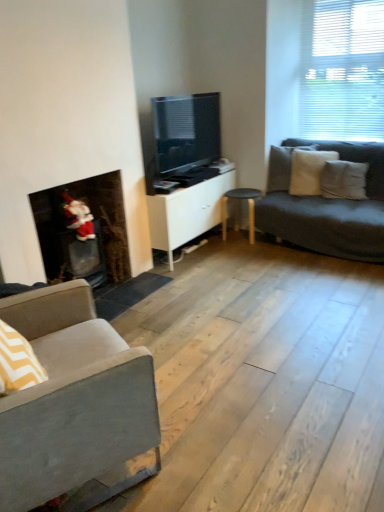
Describe the element at coordinates (83, 230) in the screenshot. The height and width of the screenshot is (512, 384). I see `velvet santa at left` at that location.

Measure the distance between white blinds at upper right and camera.

The distance of white blinds at upper right from camera is 3.76 meters.

This screenshot has width=384, height=512. Describe the element at coordinates (342, 70) in the screenshot. I see `white blinds at upper right` at that location.

In order to face gray fabric couch at left, should I rotate leftwards or rightwards?

You should look left and rotate roughly 17.845 degrees.

This screenshot has height=512, width=384. Describe the element at coordinates (344, 180) in the screenshot. I see `white soft pillow at right, placed as the first pillow when sorted from right to left` at that location.

This screenshot has height=512, width=384. I want to click on white cotton pillow at right, which is the second pillow in right-to-left order, so click(x=308, y=170).

Is white cotton pillow at right, acting as the 2th pillow starting from the left, oriented towards white soft pillow at right, which is the third pillow in left-to-right order?

Yes, white cotton pillow at right, acting as the 2th pillow starting from the left, is turned towards white soft pillow at right, which is the third pillow in left-to-right order.

Does white cotton pillow at right, which is the second pillow in right-to-left order, have a greater height compared to white soft pillow at right, which is the third pillow in left-to-right order?

A: Yes, white cotton pillow at right, which is the second pillow in right-to-left order, is taller than white soft pillow at right, which is the third pillow in left-to-right order.

From a real-world perspective, relative to white soft pillow at right, which is the third pillow in left-to-right order, is white cotton pillow at right, acting as the 2th pillow starting from the left, vertically above or below?

In terms of real-world spatial position, white cotton pillow at right, acting as the 2th pillow starting from the left, is above white soft pillow at right, which is the third pillow in left-to-right order.

Is white cotton pillow at right, acting as the 2th pillow starting from the left, to the right of white soft pillow at right, placed as the first pillow when sorted from right to left, from the viewer's perspective?

Incorrect, white cotton pillow at right, acting as the 2th pillow starting from the left, is not on the right side of white soft pillow at right, placed as the first pillow when sorted from right to left.

Considering the sizes of velvet santa at left and gray fabric couch at left in the image, is velvet santa at left taller or shorter than gray fabric couch at left?

velvet santa at left is taller than gray fabric couch at left.

Looking at the image, does velvet santa at left seem bigger or smaller compared to gray fabric couch at left?

In the image, velvet santa at left appears to be smaller than gray fabric couch at left.

The image size is (384, 512). Identify the location of fireplace on the left of gray fabric couch at left. (83, 230).

Can you confirm if gray fabric pillow at right, which appears as the first pillow when viewed from the left, is bigger than white soft pillow at right, which is the third pillow in left-to-right order?

Correct, gray fabric pillow at right, which appears as the first pillow when viewed from the left, is larger in size than white soft pillow at right, which is the third pillow in left-to-right order.

From a real-world perspective, is gray fabric pillow at right, which appears as the first pillow when viewed from the left, under white soft pillow at right, placed as the first pillow when sorted from right to left?

No, from a real-world perspective, gray fabric pillow at right, which appears as the first pillow when viewed from the left, is not below white soft pillow at right, placed as the first pillow when sorted from right to left.

From the picture: Relative to white soft pillow at right, placed as the first pillow when sorted from right to left, is gray fabric pillow at right, which appears as the first pillow when viewed from the left, in front or behind?

Visually, gray fabric pillow at right, which appears as the first pillow when viewed from the left, is located behind white soft pillow at right, placed as the first pillow when sorted from right to left.

Does gray fabric pillow at right, which appears as the first pillow when viewed from the left, turn towards white soft pillow at right, placed as the first pillow when sorted from right to left?

No.

Could you tell me if velvet santa at left is facing white soft pillow at right, which is the third pillow in left-to-right order?

No, velvet santa at left is not aimed at white soft pillow at right, which is the third pillow in left-to-right order.

Between velvet santa at left and white soft pillow at right, which is the third pillow in left-to-right order, which one is positioned behind?

white soft pillow at right, which is the third pillow in left-to-right order, is behind.

In terms of size, does velvet santa at left appear bigger or smaller than white soft pillow at right, which is the third pillow in left-to-right order?

velvet santa at left is bigger than white soft pillow at right, which is the third pillow in left-to-right order.

Which is less distant, (87, 360) or (53, 233)?

The point (87, 360) is closer.

Considering the sizes of objects gray fabric couch at left and velvet santa at left in the image provided, who is thinner, gray fabric couch at left or velvet santa at left?

Thinner between the two is velvet santa at left.

Where is `fireplace lying on the left of gray fabric couch at left`? fireplace lying on the left of gray fabric couch at left is located at coordinates (83, 230).

Considering the sizes of objects gray fabric couch at left and velvet santa at left in the image provided, who is bigger, gray fabric couch at left or velvet santa at left?

Bigger between the two is gray fabric couch at left.

Which object is further away from the camera, velvet santa at left or white cotton pillow at right, acting as the 2th pillow starting from the left?

white cotton pillow at right, acting as the 2th pillow starting from the left, is behind.

From a real-world perspective, which is physically above, velvet santa at left or white cotton pillow at right, which is the second pillow in right-to-left order?

white cotton pillow at right, which is the second pillow in right-to-left order, from a real-world perspective.

Are velvet santa at left and white cotton pillow at right, which is the second pillow in right-to-left order, making contact?

No, velvet santa at left is not beside white cotton pillow at right, which is the second pillow in right-to-left order.

Consider the image. Can you confirm if white cotton pillow at right, which is the second pillow in right-to-left order, is bigger than white blinds at upper right?

No.

Based on the photo, are white cotton pillow at right, acting as the 2th pillow starting from the left, and white blinds at upper right beside each other?

There is a gap between white cotton pillow at right, acting as the 2th pillow starting from the left, and white blinds at upper right.

Is white cotton pillow at right, acting as the 2th pillow starting from the left, to the left or to the right of white blinds at upper right in the image?

In the image, white cotton pillow at right, acting as the 2th pillow starting from the left, appears on the left side of white blinds at upper right.

From the white blinds at upper right, count 2nd pillows backward and point to it. Please provide its 2D coordinates.

[(308, 170)]

The image size is (384, 512). Identify the location of pillow that is the 1st object located behind the white soft pillow at right, which is the third pillow in left-to-right order. (308, 170).

Identify the location of studio couch in front of the velvet santa at left. (74, 401).

Estimate the real-world distances between objects in this image. Which object is further from matte black tv at center, white blinds at upper right or white soft pillow at right, which is the third pillow in left-to-right order?

white blinds at upper right is positioned further to the anchor matte black tv at center.

Considering their positions, is white blinds at upper right positioned closer to gray fabric couch at left than matte black tv at center?

matte black tv at center is positioned closer to the anchor gray fabric couch at left.

Estimate the real-world distances between objects in this image. Which object is further from black wood stool at center, matte black tv at center or white blinds at upper right?

white blinds at upper right.

Which object lies nearer to the anchor point matte black tv at center, white soft pillow at right, placed as the first pillow when sorted from right to left, or velvet santa at left?

velvet santa at left is closer to matte black tv at center.

Which object lies nearer to the anchor point matte black tv at center, white soft pillow at right, placed as the first pillow when sorted from right to left, or white blinds at upper right?

Among the two, white soft pillow at right, placed as the first pillow when sorted from right to left, is located nearer to matte black tv at center.

When comparing their distances from white matte cabinet at center, does matte black tv at center or gray fabric couch at left seem closer?

Among the two, matte black tv at center is located nearer to white matte cabinet at center.

Estimate the real-world distances between objects in this image. Which object is further from matte black tv at center, velvet santa at left or white matte cabinet at center?

Among the two, velvet santa at left is located further to matte black tv at center.

From the image, which object appears to be farther from gray fabric couch at left, black wood stool at center or velvet santa at left?

black wood stool at center.

At what (x,y) coordinates should I click in order to perform the action: click on television between gray fabric couch at left and black wood stool at center along the z-axis. Please return your answer as a coordinate pair (x, y). This screenshot has height=512, width=384. Looking at the image, I should click on [x=186, y=131].

Where is `window between gray fabric couch at left and white soft pillow at right, placed as the first pillow when sorted from right to left, in the front-back direction`? The image size is (384, 512). window between gray fabric couch at left and white soft pillow at right, placed as the first pillow when sorted from right to left, in the front-back direction is located at coordinates (342, 70).

In order to click on television situated between white matte cabinet at center and white blinds at upper right from left to right in this screenshot , I will do `click(186, 131)`.

Identify the location of table between velvet santa at left and white cotton pillow at right, which is the second pillow in right-to-left order, in the horizontal direction. (240, 210).